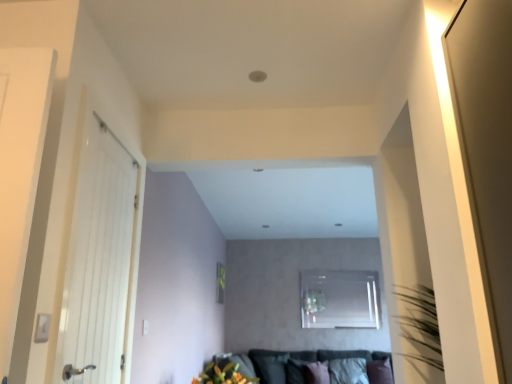
Identify the location of free space above white wooden door at left (from a real-world perspective). (115, 140).